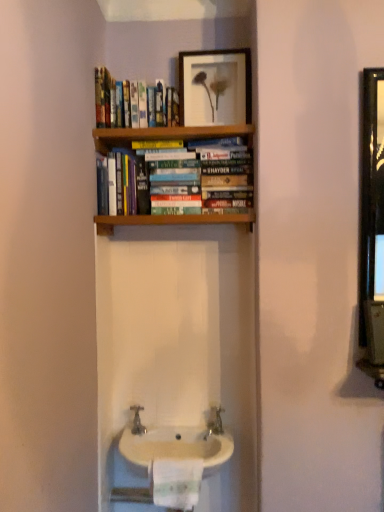
Question: Would you say silver metallic tap at center is outside white paper towel at lower center?

Choices:
 (A) no
 (B) yes

Answer: (B)

Question: Considering the relative positions of silver metallic tap at center and white paper towel at lower center in the image provided, is silver metallic tap at center in front of white paper towel at lower center?

Choices:
 (A) no
 (B) yes

Answer: (A)

Question: Does silver metallic tap at center have a lesser height compared to white paper towel at lower center?

Choices:
 (A) no
 (B) yes

Answer: (B)

Question: Can you confirm if silver metallic tap at center is bigger than white paper towel at lower center?

Choices:
 (A) yes
 (B) no

Answer: (B)

Question: Can you confirm if silver metallic tap at center is taller than white paper towel at lower center?

Choices:
 (A) yes
 (B) no

Answer: (B)

Question: From a real-world perspective, is hardcover book at center above or below matte wooden picture frame at upper center?

Choices:
 (A) below
 (B) above

Answer: (A)

Question: In terms of width, does hardcover book at center look wider or thinner when compared to matte wooden picture frame at upper center?

Choices:
 (A) thin
 (B) wide

Answer: (B)

Question: Does point (195, 175) appear closer or farther from the camera than point (235, 90)?

Choices:
 (A) farther
 (B) closer

Answer: (B)

Question: From the image's perspective, relative to matte wooden picture frame at upper center, is hardcover book at center above or below?

Choices:
 (A) below
 (B) above

Answer: (A)

Question: Would you say silver metallic tap at center is to the left or to the right of hardcover books at upper center in the picture?

Choices:
 (A) left
 (B) right

Answer: (A)

Question: From a real-world perspective, relative to hardcover books at upper center, is silver metallic tap at center vertically above or below?

Choices:
 (A) above
 (B) below

Answer: (B)

Question: Considering the positions of silver metallic tap at center and hardcover books at upper center in the image, is silver metallic tap at center taller or shorter than hardcover books at upper center?

Choices:
 (A) tall
 (B) short

Answer: (B)

Question: From the image's perspective, is silver metallic tap at center positioned above or below hardcover books at upper center?

Choices:
 (A) below
 (B) above

Answer: (A)

Question: Choose the correct answer: Is white paper towel at lower center inside matte wooden picture frame at upper center or outside it?

Choices:
 (A) outside
 (B) inside

Answer: (A)

Question: In terms of height, does white paper towel at lower center look taller or shorter compared to matte wooden picture frame at upper center?

Choices:
 (A) short
 (B) tall

Answer: (A)